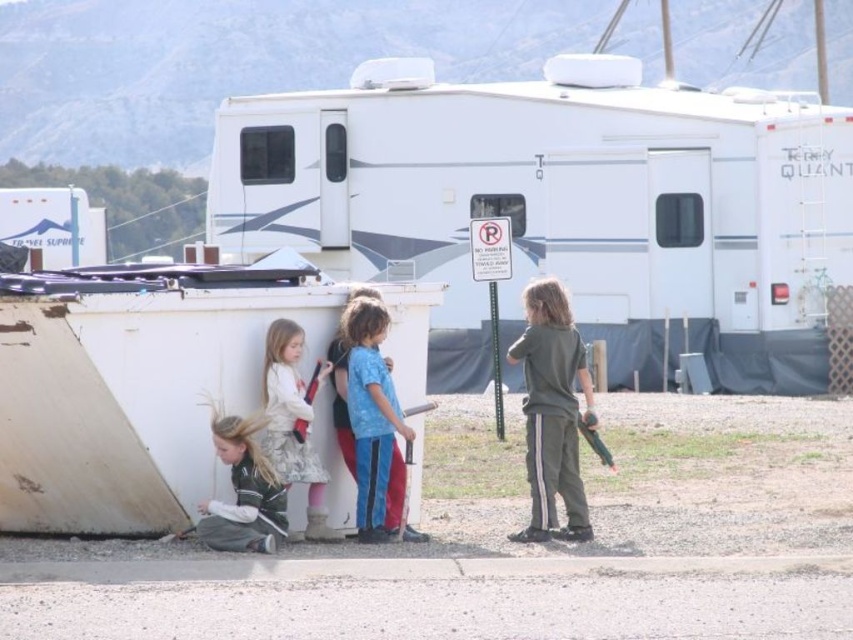
You are a parent trying to locate your child who is wearing a green fabric jacket at lower left. You are standing near the white plastic recreational vehicle at upper center. Which direction should you look to find the jacket?

The green fabric jacket at lower left is located to the lower left of the white plastic recreational vehicle at upper center, so you should look downward and to the left from the vehicle to find the jacket.

You are a hiker who has just arrived at the campground and see the white plastic recreational vehicle at upper center and the green fabric jacket at lower left. Which object is closer to you?

The green fabric jacket at lower left is closer to you because it is positioned under the white plastic recreational vehicle at upper center, indicating it is further away.

You are a photographer standing at the campground and want to capture both the white plastic recreational vehicle at upper center and the blue cotton shirt at center in the same frame. Which object should you focus on first to ensure both are in the frame?

The white plastic recreational vehicle at upper center is taller than the blue cotton shirt at center, so you should focus on the white plastic recreational vehicle at upper center first to ensure both are in the frame.